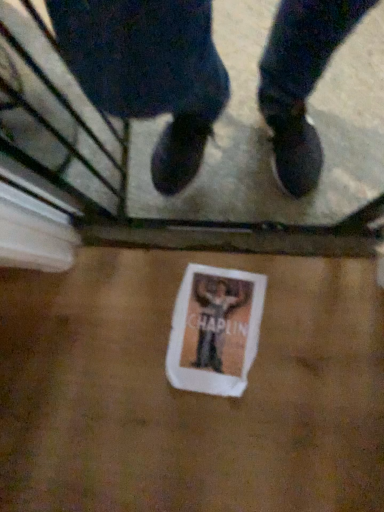
Question: From a real-world perspective, is white paper flyer at center below matte black shoes at center?

Choices:
 (A) yes
 (B) no

Answer: (A)

Question: Considering the relative positions of white paper flyer at center and matte black shoes at center in the image provided, is white paper flyer at center to the left of matte black shoes at center from the viewer's perspective?

Choices:
 (A) no
 (B) yes

Answer: (B)

Question: Considering the relative sizes of white paper flyer at center and matte black shoes at center in the image provided, is white paper flyer at center taller than matte black shoes at center?

Choices:
 (A) no
 (B) yes

Answer: (A)

Question: Is white paper flyer at center wider than matte black shoes at center?

Choices:
 (A) no
 (B) yes

Answer: (B)

Question: Is white paper flyer at center thinner than matte black shoes at center?

Choices:
 (A) yes
 (B) no

Answer: (B)

Question: Is white paper flyer at center oriented away from matte black shoes at center?

Choices:
 (A) no
 (B) yes

Answer: (A)

Question: Considering the relative sizes of matte black shoes at center and white paper flyer at center in the image provided, is matte black shoes at center bigger than white paper flyer at center?

Choices:
 (A) no
 (B) yes

Answer: (B)

Question: Is matte black shoes at center positioned behind white paper flyer at center?

Choices:
 (A) yes
 (B) no

Answer: (B)

Question: Is matte black shoes at center taller than white paper flyer at center?

Choices:
 (A) yes
 (B) no

Answer: (A)

Question: Is white paper flyer at center surrounded by matte black shoes at center?

Choices:
 (A) no
 (B) yes

Answer: (A)

Question: Is matte black shoes at center to the left of white paper flyer at center from the viewer's perspective?

Choices:
 (A) yes
 (B) no

Answer: (B)

Question: Are matte black shoes at center and white paper flyer at center located far from each other?

Choices:
 (A) yes
 (B) no

Answer: (B)

Question: Is matte black shoes at center in front of or behind white paper flyer at center in the image?

Choices:
 (A) front
 (B) behind

Answer: (A)